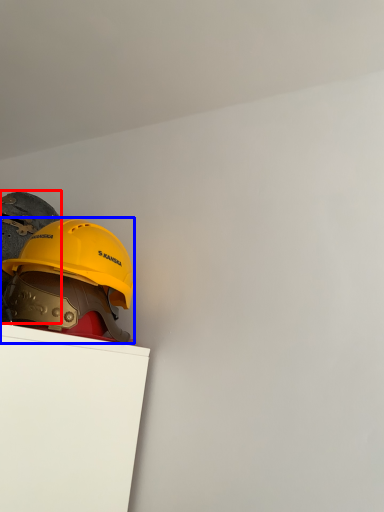
Question: Which object is further to the camera taking this photo, helmet (highlighted by a red box) or helmet (highlighted by a blue box)?

Choices:
 (A) helmet
 (B) helmet

Answer: (B)